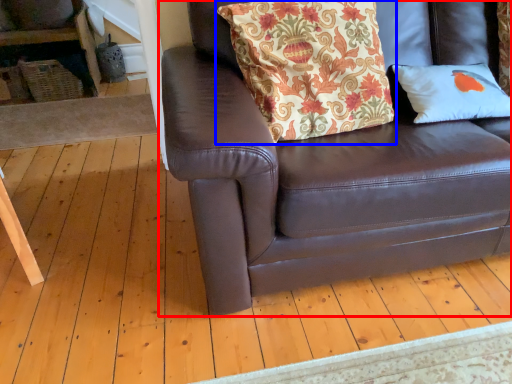
Question: Which object is closer to the camera taking this photo, studio couch (highlighted by a red box) or pillow (highlighted by a blue box)?

Choices:
 (A) studio couch
 (B) pillow

Answer: (A)